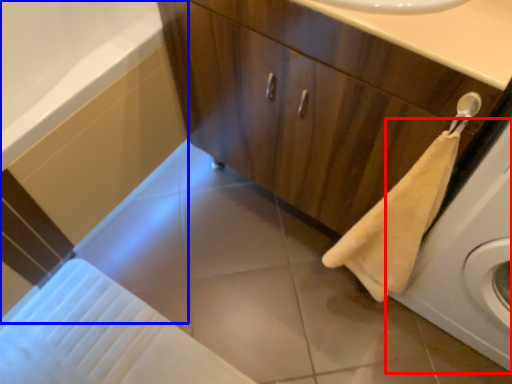
Question: Which object appears farthest to the camera in this image, washing machine (highlighted by a red box) or bath (highlighted by a blue box)?

Choices:
 (A) washing machine
 (B) bath

Answer: (B)